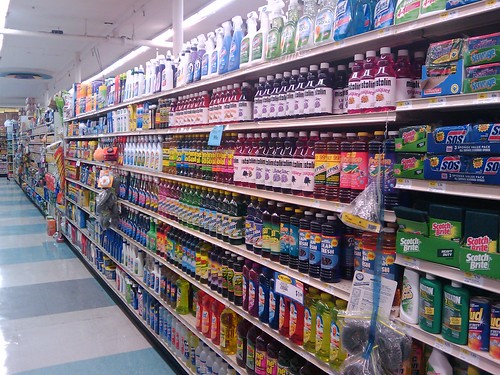
The height and width of the screenshot is (375, 500). I want to click on green sponges, so click(412, 135), click(411, 158), click(418, 224), click(441, 226), click(472, 231).